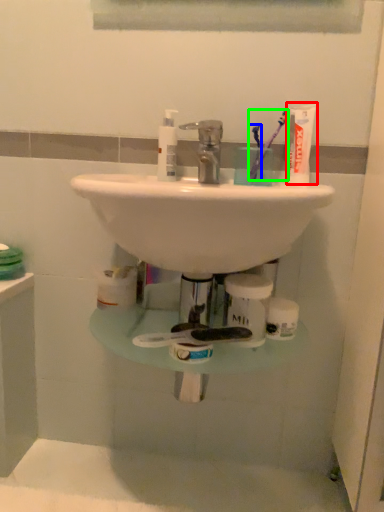
Question: Based on their relative distances, which object is nearer to toothpaste (highlighted by a red box)? Choose from toothbrush (highlighted by a blue box) and toothbrush (highlighted by a green box).

Choices:
 (A) toothbrush
 (B) toothbrush

Answer: (B)